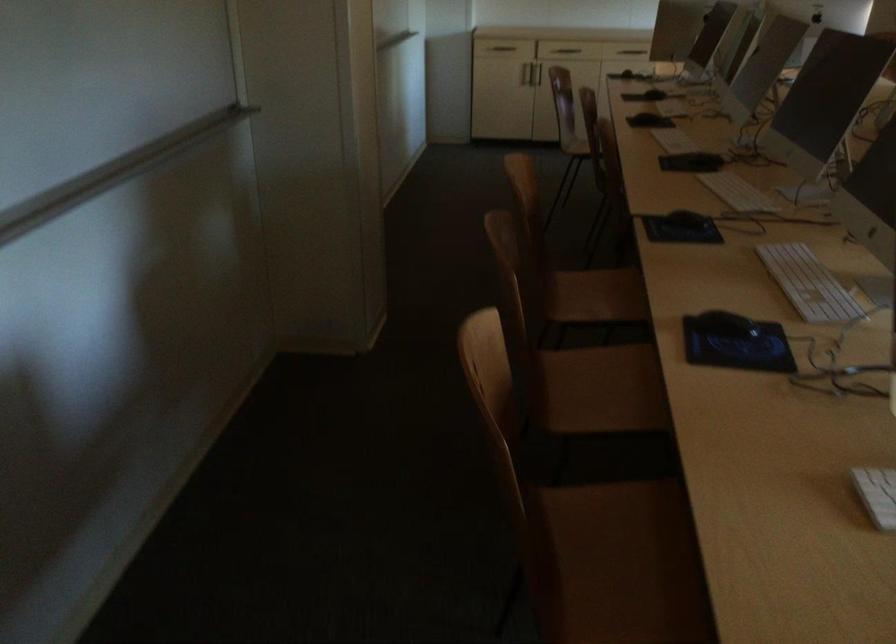
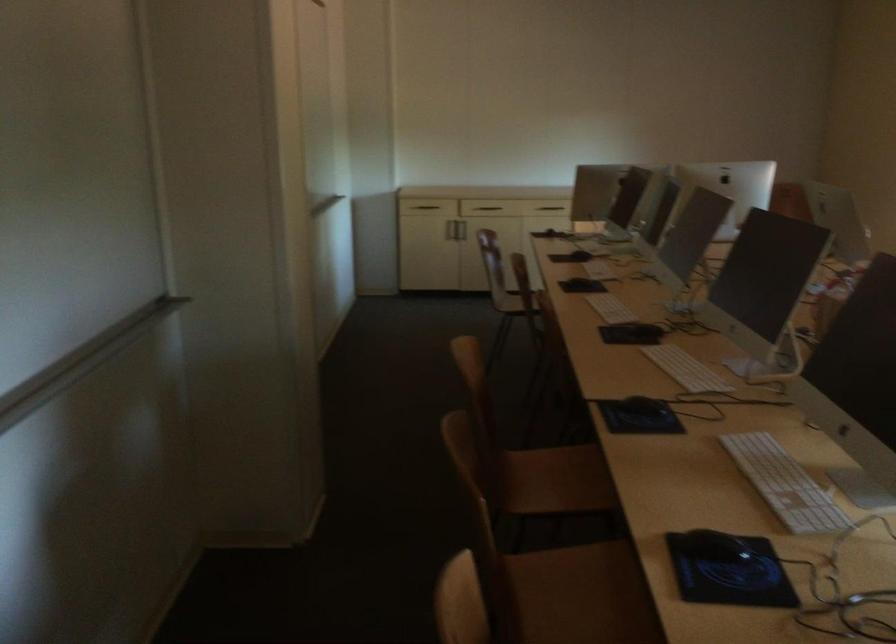
In the second image, find the point that corresponds to [530,73] in the first image.

(454, 230)